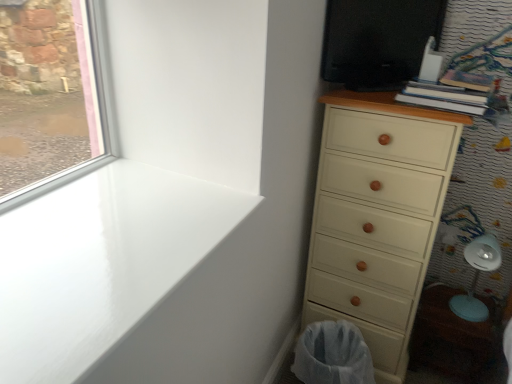
Identify the location of blank space situated above white glossy window sill at upper left (from a real-world perspective). (102, 228).